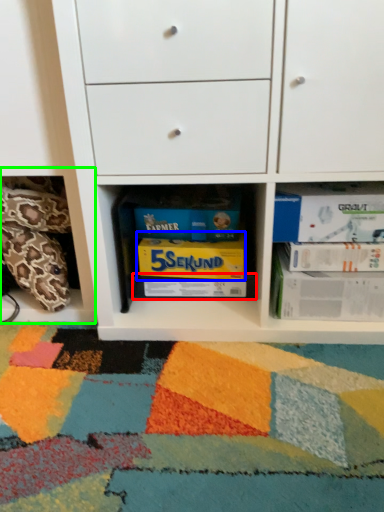
Question: Based on their relative distances, which object is nearer to paperback book (highlighted by a red box)? Choose from paperback book (highlighted by a blue box) and shelf (highlighted by a green box).

Choices:
 (A) paperback book
 (B) shelf

Answer: (A)